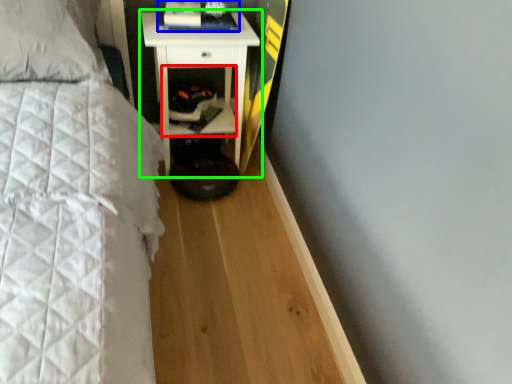
Question: Which is farther away from cabinet (highlighted by a red box)? book (highlighted by a blue box) or nightstand (highlighted by a green box)?

Choices:
 (A) book
 (B) nightstand

Answer: (A)